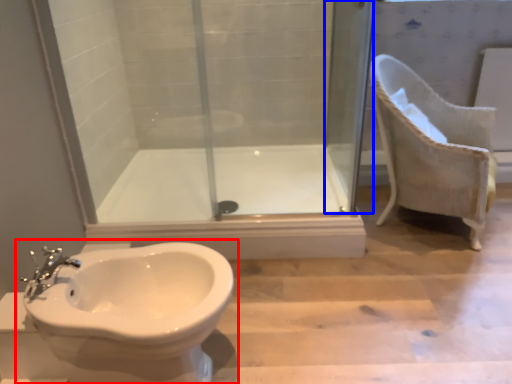
Question: Which point is closer to the camera, toilet (highlighted by a red box) or screen door (highlighted by a blue box)?

Choices:
 (A) toilet
 (B) screen door

Answer: (A)